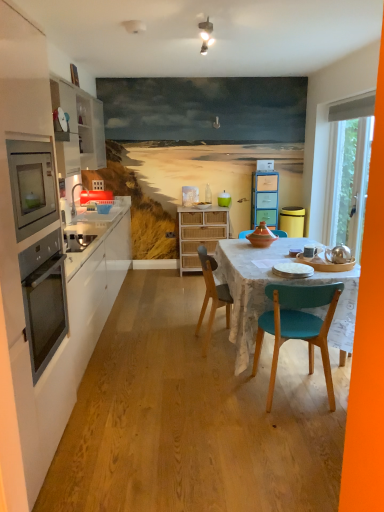
In order to click on vacant space in white matte plate at center, which is counted as the 2th plate, starting from the top (from a real-world perspective) in this screenshot , I will do `click(285, 375)`.